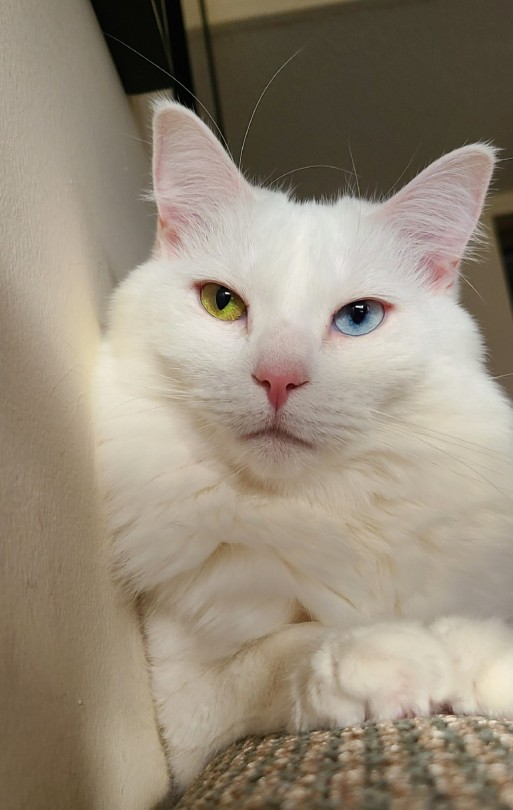
Locate an element on the screen. The image size is (513, 810). doorway is located at coordinates (500, 228).